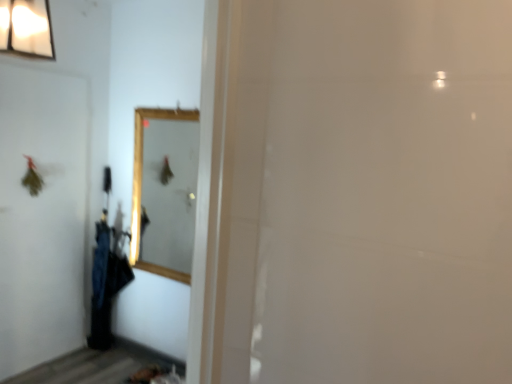
Question: Does point (5, 374) appear closer or farther from the camera than point (138, 114)?

Choices:
 (A) farther
 (B) closer

Answer: (B)

Question: From their relative heights in the image, would you say white matte screen door at left is taller or shorter than wooden framed mirror at center?

Choices:
 (A) short
 (B) tall

Answer: (B)

Question: Which object is positioned farthest from the white matte screen door at left?

Choices:
 (A) black fabric umbrella at left
 (B) wooden framed mirror at center

Answer: (B)

Question: Based on their relative distances, which object is nearer to the wooden framed mirror at center?

Choices:
 (A) white matte screen door at left
 (B) black fabric umbrella at left

Answer: (B)